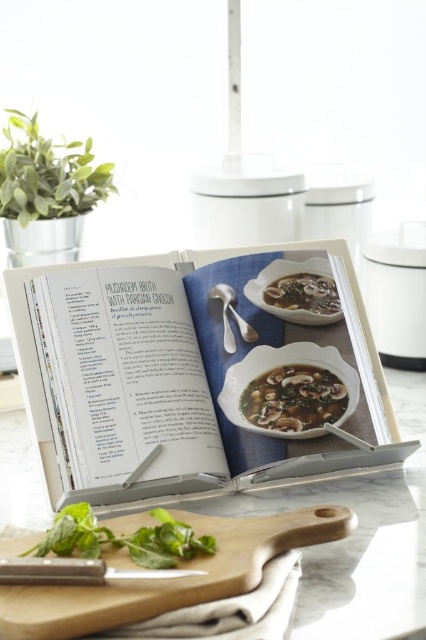
You are a chef preparing a dish and need to place the green leafy herb at lower left and the satin silver spoon at upper center on a plate. Based on their positions in the image, which one is closer to the left edge of the plate?

The green leafy herb at lower left is positioned on the left side of the satin silver spoon at upper center, so it is closer to the left edge of the plate.

You are a chef standing in front of the recipe book and need to place two ingredients on the countertop. The first ingredient must be placed at point (152, 541) and the second at point (230, 352). Which point is closer to you when you are facing the book?

Point (152, 541) is closer to you because it is in front of point (230, 352).

You are a chef preparing to take a photo of the recipe book. The green leafy herb at lower left is in the way of the camera. Where should you move it to avoid blocking the main subject?

You should move the green leafy herb at lower left away from point (123,538) to ensure it doesn not block the recipe book.